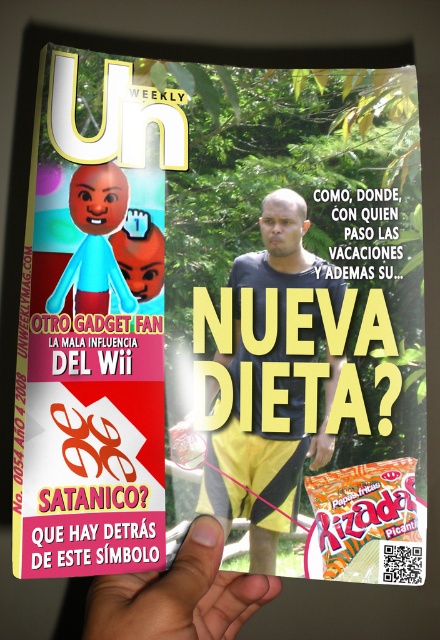
Based on the scene described, where is the matte black shirt at center located in terms of coordinates?

The matte black shirt at center is located at coordinates point (x=272, y=381).

You are a photographer taking a picture of the magazine cover. You notice two points marked on the cover. The first point is at coordinates point (35, 332) and the second at point (268, 506). Based on their positions, which point is closer to the camera?

Point (35, 332) is in front of point (268, 506), so it is closer to the camera.

You are a tailor measuring a customer for a new suit. You need to determine if the distance between the matte black shirt at center and the light skin tone finger at lower center is sufficient to comfortably fit a standard 12 cm suit button. Can you confirm if there is enough space?

The distance between the matte black shirt at center and the light skin tone finger at lower center is 11.45 centimeters, which is slightly less than the required 12 cm for a standard suit button. Therefore, there isn not enough space to comfortably fit the button.